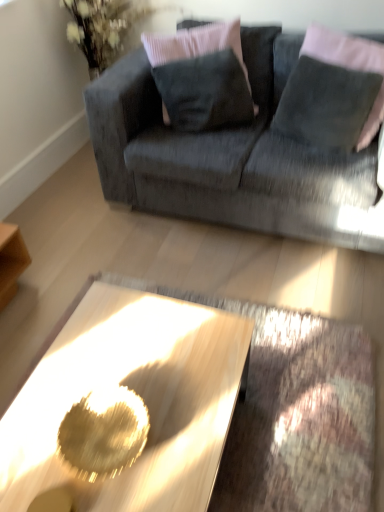
Question: Considering the relative positions of metallic gold coffee table at center and velvet gray couch at upper center in the image provided, is metallic gold coffee table at center to the left of velvet gray couch at upper center from the viewer's perspective?

Choices:
 (A) no
 (B) yes

Answer: (B)

Question: Does metallic gold coffee table at center appear on the right side of velvet gray couch at upper center?

Choices:
 (A) no
 (B) yes

Answer: (A)

Question: Is metallic gold coffee table at center bigger than velvet gray couch at upper center?

Choices:
 (A) no
 (B) yes

Answer: (A)

Question: Is metallic gold coffee table at center positioned before velvet gray couch at upper center?

Choices:
 (A) yes
 (B) no

Answer: (A)

Question: Does metallic gold coffee table at center touch velvet gray couch at upper center?

Choices:
 (A) no
 (B) yes

Answer: (A)

Question: From the image's perspective, is metallic gold coffee table at center beneath velvet gray couch at upper center?

Choices:
 (A) yes
 (B) no

Answer: (A)

Question: Is the position of metallic gold coffee table at center more distant than that of velvet gray pillow at upper right, which is the second pillow in left-to-right order?

Choices:
 (A) no
 (B) yes

Answer: (A)

Question: Does metallic gold coffee table at center have a lesser width compared to velvet gray pillow at upper right, which is the second pillow in left-to-right order?

Choices:
 (A) no
 (B) yes

Answer: (A)

Question: From the image's perspective, would you say metallic gold coffee table at center is positioned over velvet gray pillow at upper right, which is the second pillow in left-to-right order?

Choices:
 (A) yes
 (B) no

Answer: (B)

Question: Could you tell me if metallic gold coffee table at center is facing velvet gray pillow at upper right, which appears as the 1th pillow when viewed from the right?

Choices:
 (A) no
 (B) yes

Answer: (A)

Question: From a real-world perspective, does metallic gold coffee table at center stand above velvet gray pillow at upper right, which is the second pillow in left-to-right order?

Choices:
 (A) yes
 (B) no

Answer: (B)

Question: Is metallic gold coffee table at center positioned far away from velvet gray pillow at upper right, which appears as the 1th pillow when viewed from the right?

Choices:
 (A) yes
 (B) no

Answer: (A)

Question: From the image's perspective, would you say velvet dark gray pillow at upper center, which is the 1th pillow in left-to-right order, is shown under metallic gold coffee table at center?

Choices:
 (A) yes
 (B) no

Answer: (B)